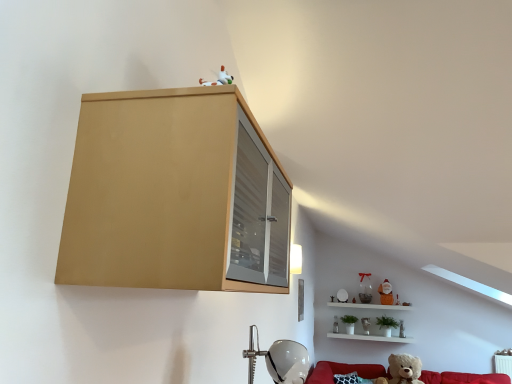
Locate an element on the screen. The image size is (512, 384). matte white teddy bear at upper right, which is the 6th toy from front to back is located at coordinates (336, 324).

What is the approximate width of matte brown teddy bear at upper right, positioned as the third toy in back-to-front order?

Result: It is 7.86 inches.

Image resolution: width=512 pixels, height=384 pixels. What do you see at coordinates (370, 306) in the screenshot? I see `white glossy shelf at lower right` at bounding box center [370, 306].

What do you see at coordinates (344, 371) in the screenshot? I see `red fabric couch at lower right` at bounding box center [344, 371].

This screenshot has height=384, width=512. What do you see at coordinates (403, 370) in the screenshot?
I see `fuzzy beige teddy bear at lower right, the sixth toy viewed from the back` at bounding box center [403, 370].

At what (x,y) coordinates should I click in order to perform the action: click on fuzzy beige teddy bear at lower right, arranged as the 1th toy when viewed from the front. Please return your answer as a coordinate pair (x, y). Image resolution: width=512 pixels, height=384 pixels. Looking at the image, I should click on (403, 370).

You are a GUI agent. You are given a task and a screenshot of the screen. Output one action in this format:
    pyautogui.click(x=<x>, y=<y>)
    Task: Click on the clear glass vase at upper right, acting as the 5th toy starting from the front
    The image size is (512, 384).
    Given the screenshot: What is the action you would take?
    pyautogui.click(x=365, y=288)

The width and height of the screenshot is (512, 384). Find the location of `matte wood cabinet at upper left`. matte wood cabinet at upper left is located at coordinates (175, 195).

Is there a large distance between clear glass vase at upper right, acting as the 5th toy starting from the front, and white glossy shelf at lower right?

They are positioned close to each other.

Is clear glass vase at upper right, acting as the 5th toy starting from the front, shorter than white glossy shelf at lower right?

Yes.

Between clear glass vase at upper right, which is the 2th toy in back-to-front order, and white glossy shelf at lower right, which one appears on the right side from the viewer's perspective?

white glossy shelf at lower right is more to the right.

From a real-world perspective, which object stands above the other?

From a 3D spatial view, clear glass vase at upper right, which is the 2th toy in back-to-front order, is above.

In terms of height, does matte brown teddy bear at upper right, positioned as the third toy in back-to-front order, look taller or shorter compared to matte wood cabinet at upper left?

Clearly, matte brown teddy bear at upper right, positioned as the third toy in back-to-front order, is shorter compared to matte wood cabinet at upper left.

Considering the positions of objects matte brown teddy bear at upper right, the fourth toy when ordered from front to back, and matte wood cabinet at upper left in the image provided, who is more to the right, matte brown teddy bear at upper right, the fourth toy when ordered from front to back, or matte wood cabinet at upper left?

From the viewer's perspective, matte brown teddy bear at upper right, the fourth toy when ordered from front to back, appears more on the right side.

Is matte brown teddy bear at upper right, positioned as the third toy in back-to-front order, beside matte wood cabinet at upper left?

No.

Identify the location of toy that is the 4th object located behind the matte wood cabinet at upper left. Image resolution: width=512 pixels, height=384 pixels. (386, 293).

Looking at this image, considering the sizes of objects white matte teddy bear at upper center, which is the 3th toy from front to back, and red fabric couch at lower right in the image provided, who is thinner, white matte teddy bear at upper center, which is the 3th toy from front to back, or red fabric couch at lower right?

white matte teddy bear at upper center, which is the 3th toy from front to back.

Could you measure the distance between white matte teddy bear at upper center, which is the 3th toy from front to back, and red fabric couch at lower right?

white matte teddy bear at upper center, which is the 3th toy from front to back, and red fabric couch at lower right are 26.10 inches apart from each other.

From a real-world perspective, is white matte teddy bear at upper center, the 4th toy viewed from the back, below red fabric couch at lower right?

No.

From the image's perspective, which one is positioned higher, white matte teddy bear at upper center, the 4th toy viewed from the back, or red fabric couch at lower right?

white matte teddy bear at upper center, the 4th toy viewed from the back, appears higher in the image.

Which is less distant, (x=411, y=308) or (x=428, y=383)?

Point (x=428, y=383)

From a real-world perspective, is white glossy shelf at lower right under red fabric couch at lower right?

No, from a real-world perspective, white glossy shelf at lower right is not under red fabric couch at lower right.

In the image, is white glossy shelf at lower right positioned in front of or behind red fabric couch at lower right?

Clearly, white glossy shelf at lower right is behind red fabric couch at lower right.

From the image's perspective, is white glossy shelf at lower right on red fabric couch at lower right?

Yes, from the image's perspective, white glossy shelf at lower right is over red fabric couch at lower right.

Does matte brown teddy bear at upper right, the fourth toy when ordered from front to back, have a greater width compared to white matte teddy bear at upper center, the 4th toy viewed from the back?

Yes, matte brown teddy bear at upper right, the fourth toy when ordered from front to back, is wider than white matte teddy bear at upper center, the 4th toy viewed from the back.

Does matte brown teddy bear at upper right, positioned as the third toy in back-to-front order, come behind white matte teddy bear at upper center, which is the 3th toy from front to back?

Yes, it is behind white matte teddy bear at upper center, which is the 3th toy from front to back.

Between matte brown teddy bear at upper right, the fourth toy when ordered from front to back, and white matte teddy bear at upper center, which is the 3th toy from front to back, which one has smaller size?

white matte teddy bear at upper center, which is the 3th toy from front to back.

Is matte brown teddy bear at upper right, the fourth toy when ordered from front to back, looking in the opposite direction of white matte teddy bear at upper center, which is the 3th toy from front to back?

That's not correct — matte brown teddy bear at upper right, the fourth toy when ordered from front to back, is not looking away from white matte teddy bear at upper center, which is the 3th toy from front to back.

Is matte wood cabinet at upper left completely or partially inside white glossy shelf at lower right?

Actually, matte wood cabinet at upper left is outside white glossy shelf at lower right.

Considering the sizes of objects white glossy shelf at lower right and matte wood cabinet at upper left in the image provided, who is thinner, white glossy shelf at lower right or matte wood cabinet at upper left?

With smaller width is white glossy shelf at lower right.

Considering the sizes of objects white glossy shelf at lower right and matte wood cabinet at upper left in the image provided, who is taller, white glossy shelf at lower right or matte wood cabinet at upper left?

white glossy shelf at lower right.

Is matte brown teddy bear at upper right, positioned as the third toy in back-to-front order, in contact with fuzzy beige teddy bear at lower right, arranged as the 1th toy when viewed from the front?

They are not placed beside each other.

From the image's perspective, would you say matte brown teddy bear at upper right, positioned as the third toy in back-to-front order, is shown under fuzzy beige teddy bear at lower right, arranged as the 1th toy when viewed from the front?

No, from the image's perspective, matte brown teddy bear at upper right, positioned as the third toy in back-to-front order, is not below fuzzy beige teddy bear at lower right, arranged as the 1th toy when viewed from the front.

Is matte brown teddy bear at upper right, positioned as the third toy in back-to-front order, shorter than fuzzy beige teddy bear at lower right, arranged as the 1th toy when viewed from the front?

Yes.

The height and width of the screenshot is (384, 512). I want to click on shelf below the clear glass vase at upper right, which is the 2th toy in back-to-front order (from a real-world perspective), so click(x=370, y=306).

The width and height of the screenshot is (512, 384). I want to click on cabinetry on the left of matte brown teddy bear at upper right, the fourth toy when ordered from front to back, so coord(175,195).

Estimate the real-world distances between objects in this image. Which object is closer to white glossy shelf at lower right, red fabric couch at lower right or matte white teddy bear at upper right, the first toy in the back-to-front sequence?

matte white teddy bear at upper right, the first toy in the back-to-front sequence, is closer to white glossy shelf at lower right.

When comparing their distances from clear glass vase at upper right, which is the 2th toy in back-to-front order, does matte white teddy bear at upper right, the first toy in the back-to-front sequence, or white glossy shelf at lower right seem further?

matte white teddy bear at upper right, the first toy in the back-to-front sequence, is positioned further to the anchor clear glass vase at upper right, which is the 2th toy in back-to-front order.

Considering their positions, is translucent glass vase at lower right, arranged as the fifth toy when viewed from the back, positioned further to white matte teddy bear at upper center, which is the 3th toy from front to back, than fuzzy beige teddy bear at lower right, the sixth toy viewed from the back?

The object further to white matte teddy bear at upper center, which is the 3th toy from front to back, is fuzzy beige teddy bear at lower right, the sixth toy viewed from the back.

Based on their spatial positions, is red fabric couch at lower right or matte wood cabinet at upper left further from translucent glass vase at lower right, arranged as the fifth toy when viewed from the back?

matte wood cabinet at upper left is positioned further to the anchor translucent glass vase at lower right, arranged as the fifth toy when viewed from the back.

Based on their spatial positions, is white glossy shelf at lower right or red fabric couch at lower right closer to matte brown teddy bear at upper right, the fourth toy when ordered from front to back?

white glossy shelf at lower right is positioned closer to the anchor matte brown teddy bear at upper right, the fourth toy when ordered from front to back.

From the image, which object appears to be farther from white matte teddy bear at upper center, which is the 3th toy from front to back, red fabric couch at lower right or matte white teddy bear at upper right, the first toy in the back-to-front sequence?

Based on the image, red fabric couch at lower right appears to be further to white matte teddy bear at upper center, which is the 3th toy from front to back.

When comparing their distances from matte white teddy bear at upper right, which is the 6th toy from front to back, does clear glass vase at upper right, which is the 2th toy in back-to-front order, or fuzzy beige teddy bear at lower right, arranged as the 1th toy when viewed from the front, seem closer?

Based on the image, clear glass vase at upper right, which is the 2th toy in back-to-front order, appears to be nearer to matte white teddy bear at upper right, which is the 6th toy from front to back.

Considering their positions, is red fabric couch at lower right positioned closer to white matte teddy bear at upper center, which is the 3th toy from front to back, than matte brown teddy bear at upper right, positioned as the third toy in back-to-front order?

The object closer to white matte teddy bear at upper center, which is the 3th toy from front to back, is matte brown teddy bear at upper right, positioned as the third toy in back-to-front order.

Locate an element on the screen. This screenshot has height=384, width=512. shelf between clear glass vase at upper right, which is the 2th toy in back-to-front order, and matte white teddy bear at upper right, which is the 6th toy from front to back, in the up-down direction is located at coordinates (370, 306).

Where is `toy between fuzzy beige teddy bear at lower right, the sixth toy viewed from the back, and white matte teddy bear at upper center, which is the 3th toy from front to back, along the z-axis`? The image size is (512, 384). toy between fuzzy beige teddy bear at lower right, the sixth toy viewed from the back, and white matte teddy bear at upper center, which is the 3th toy from front to back, along the z-axis is located at coordinates (401, 329).

Find the location of a particular element. This screenshot has height=384, width=512. shelf between clear glass vase at upper right, acting as the 5th toy starting from the front, and translucent glass vase at lower right, arranged as the fifth toy when viewed from the back, in the up-down direction is located at coordinates (370, 306).

Locate an element on the screen. The width and height of the screenshot is (512, 384). shelf located between matte wood cabinet at upper left and clear glass vase at upper right, which is the 2th toy in back-to-front order, in the depth direction is located at coordinates (370, 306).